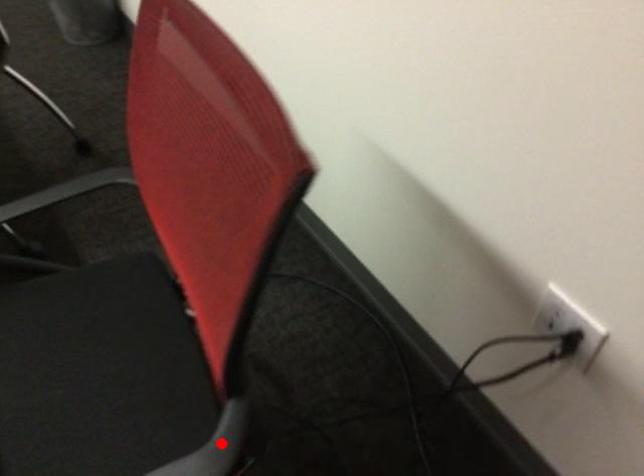
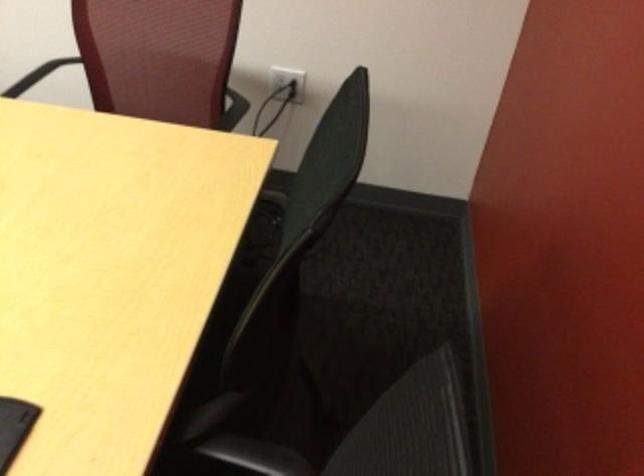
Question: I am providing you with two images of the same scene from different viewpoints. A red point is marked on the first image. Is the red point's position out of view in image 2?

Choices:
 (A) Yes
 (B) No

Answer: (A)